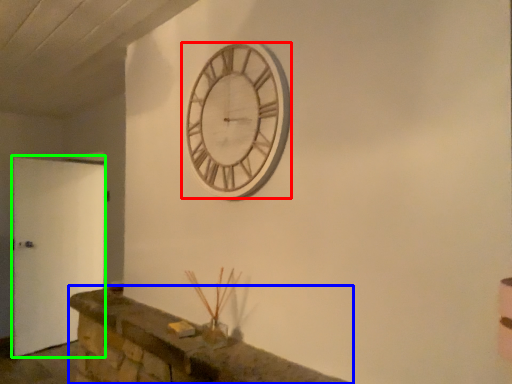
Question: Which is farther away from wall clock (highlighted by a red box)? mantle (highlighted by a blue box) or door (highlighted by a green box)?

Choices:
 (A) mantle
 (B) door

Answer: (B)